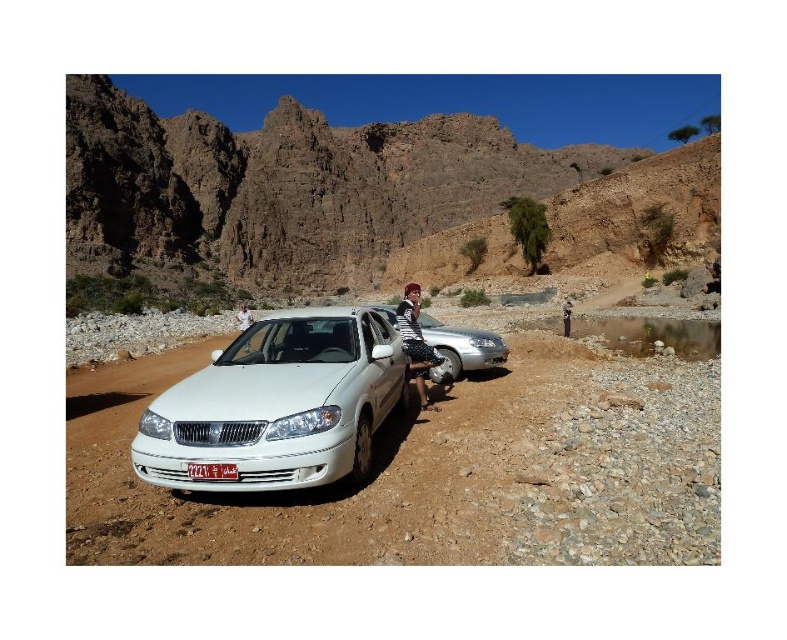
In the scene shown: You are a hiker planning to cross the rocky terrain between the striped fabric shirt at center and the brown leather jacket at lower right. Which clothing item would you choose to wear for better mobility, and why?

You should choose the striped fabric shirt at center because it is thinner than the brown leather jacket at lower right, providing more flexibility and ease of movement in the rugged terrain.

You are standing at the point marked as point (x=494, y=349) in the image. The cliff to your left is 50 meters tall. Can you see the top of the cliff from your current position?

The cliff to your left is 50 meters tall, and you are 53.27 meters away from the point marked as point (x=494, y=349). Since the distance to the cliff is less than your distance from the point, you can see the top of the cliff from your current position.

Based on the photo, you are a hiker trying to locate your friend who is wearing a striped fabric shirt at center and another friend wearing a brown leather jacket at lower right. Based on the scene, which friend is closer to the steep cliff on the left side?

The striped fabric shirt at center is to the left of brown leather jacket at lower right, so the friend wearing the striped fabric shirt at center is closer to the steep cliff on the left side.